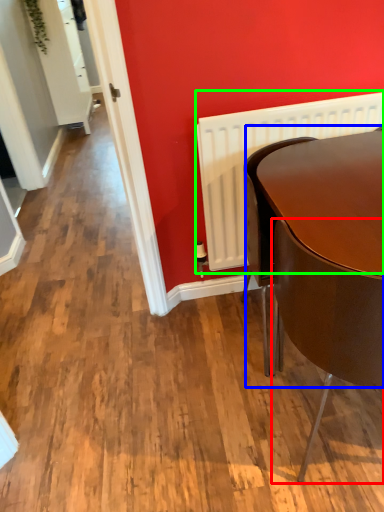
Question: Based on their relative distances, which object is nearer to chair (highlighted by a red box)? Choose from round table (highlighted by a blue box) and radiator (highlighted by a green box).

Choices:
 (A) round table
 (B) radiator

Answer: (A)